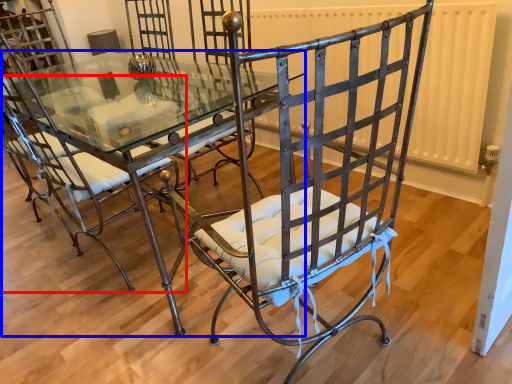
Question: Which object is closer to the camera taking this photo, chair (highlighted by a red box) or table (highlighted by a blue box)?

Choices:
 (A) chair
 (B) table

Answer: (A)